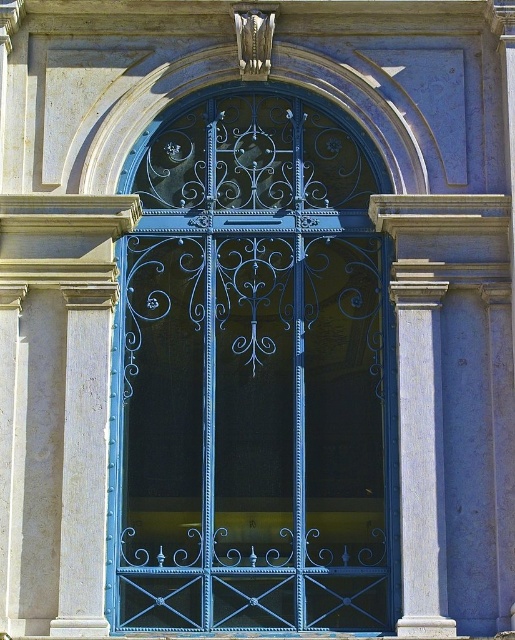
Who is lower down, blue wrought iron door at center or smooth stone column at left?

smooth stone column at left is below.

Is point (254, 115) more distant than point (111, 294)?

Yes, point (254, 115) is farther from viewer.

Locate an element on the screen. This screenshot has width=515, height=640. blue wrought iron door at center is located at coordinates (253, 374).

Who is higher up, blue wrought iron door at center or white marble column at right?

blue wrought iron door at center is above.

Consider the image. Can you confirm if blue wrought iron door at center is positioned to the right of white marble column at right?

No, blue wrought iron door at center is not to the right of white marble column at right.

Find the location of a particular element. This screenshot has height=640, width=515. blue wrought iron door at center is located at coordinates (253, 374).

Is white marble column at right to the left of smooth stone column at left from the viewer's perspective?

In fact, white marble column at right is to the right of smooth stone column at left.

Which of these two, white marble column at right or smooth stone column at left, stands taller?

With more height is white marble column at right.

Who is more forward, (431, 540) or (94, 412)?

Point (431, 540) is in front.

You are a GUI agent. You are given a task and a screenshot of the screen. Output one action in this format:
    pyautogui.click(x=<x>, y=<y>)
    Task: Click on the white marble column at right
    The image size is (515, 640).
    Given the screenshot: What is the action you would take?
    pyautogui.click(x=420, y=449)